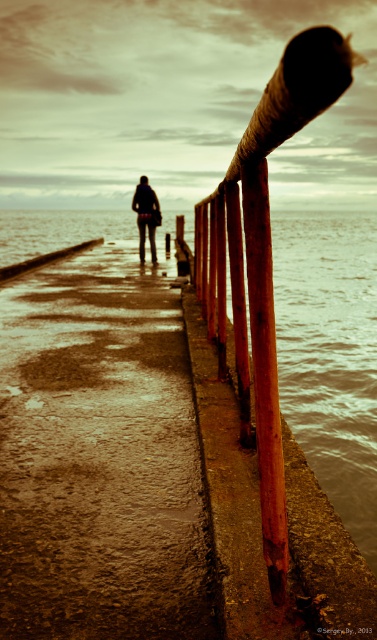
You are standing on the weathered concrete walkway and see the rusty metal pole at center and the dark gray fabric jacket at center. Which object is shorter in height?

The rusty metal pole at center is shorter in height compared to the dark gray fabric jacket at center.

You are a photographer trying to capture the rusty metal water at right and the dark gray fabric jacket at center in the same frame. Based on their sizes in the image, which object would you need to focus on more carefully to ensure it appears sharp and detailed?

The dark gray fabric jacket at center requires more careful focus because it is smaller in the image compared to the rusty metal water at right, which is larger and may be easier to capture sharply due to its size.